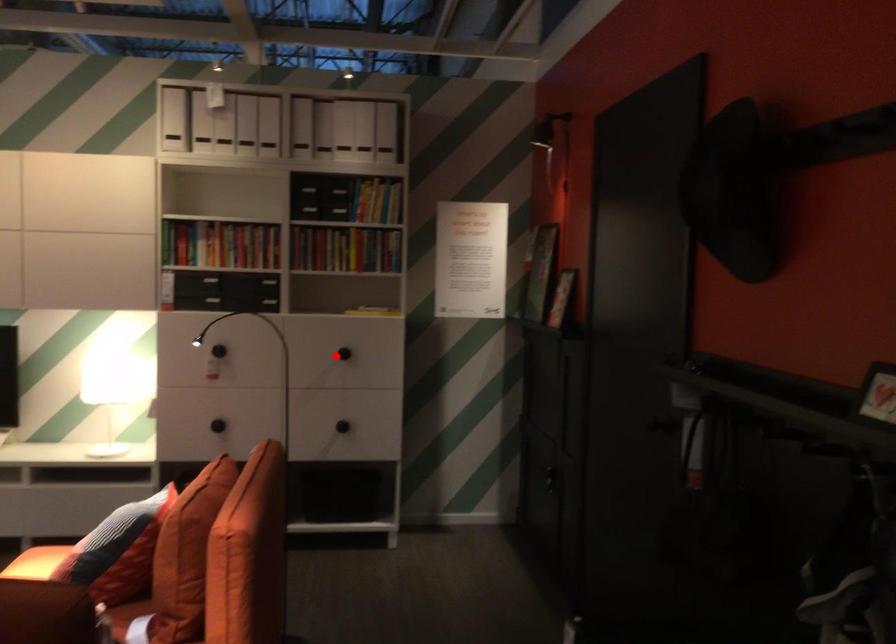
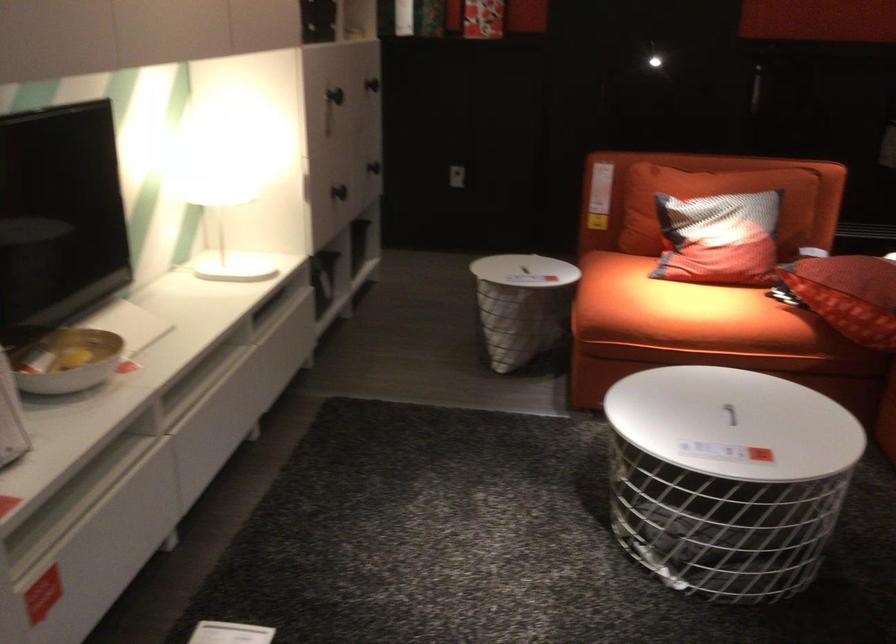
In the second image, find the point that corresponds to the highlighted location in the first image.

(372, 84)